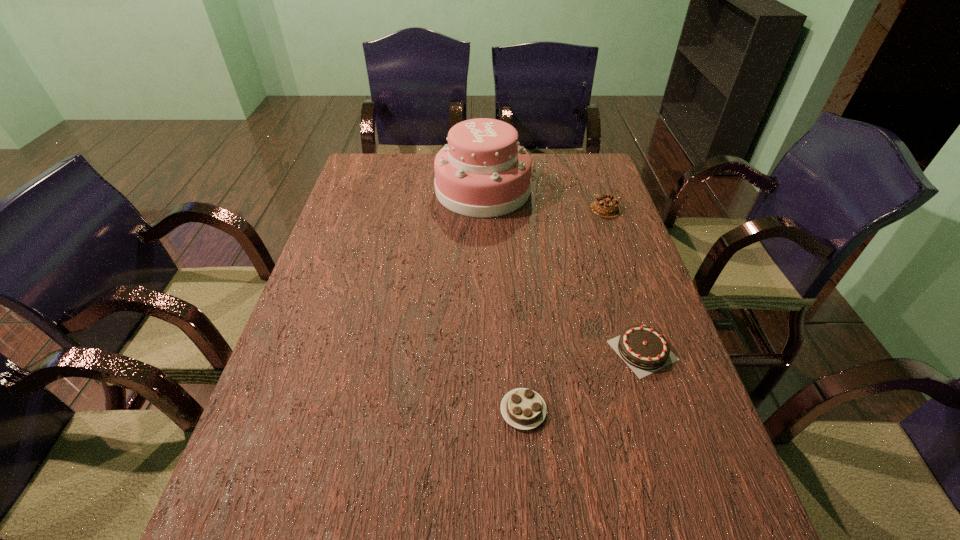
The width and height of the screenshot is (960, 540). In order to click on chocolate cake identified as the closest to the second shortest chocolate cake in this screenshot , I will do `click(522, 408)`.

Locate an element on the screen. free space that satisfies the following two spatial constraints: 1. on the front side of the leftmost chocolate cake; 2. on the right side of the tallest object is located at coordinates (485, 410).

I want to click on free space in the image that satisfies the following two spatial constraints: 1. on the front side of the birthday cake; 2. on the left side of the leftmost chocolate cake, so click(485, 410).

Where is `free space in the image that satisfies the following two spatial constraints: 1. on the back side of the second shortest object; 2. on the left side of the tallest chocolate cake`? free space in the image that satisfies the following two spatial constraints: 1. on the back side of the second shortest object; 2. on the left side of the tallest chocolate cake is located at coordinates (596, 208).